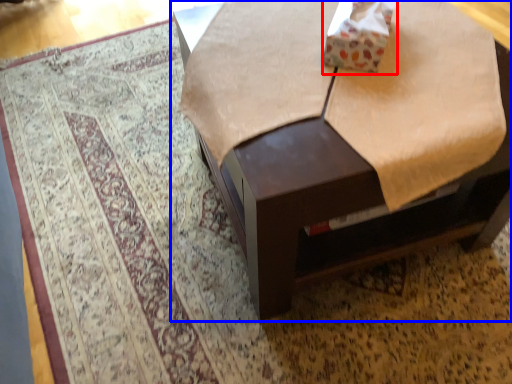
Question: Among these objects, which one is nearest to the camera, cardboard box (highlighted by a red box) or table (highlighted by a blue box)?

Choices:
 (A) cardboard box
 (B) table

Answer: (B)